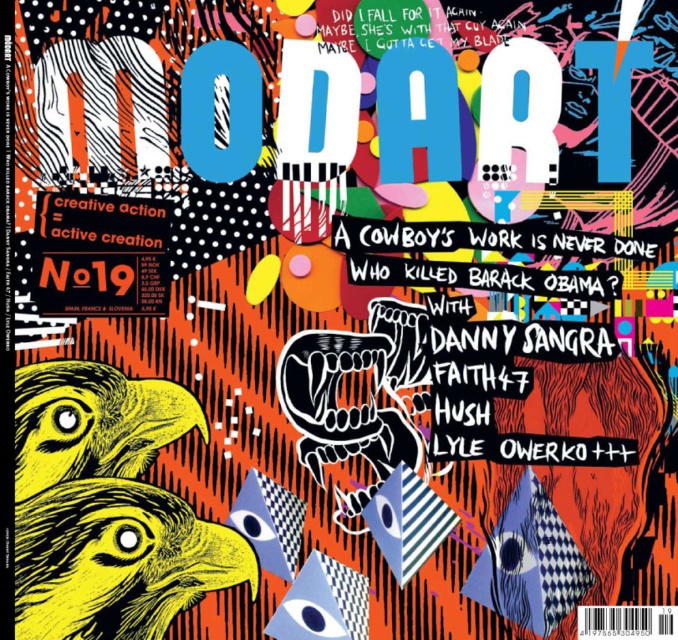
Can you confirm if yellow linework eagle at lower left is bigger than yellow linocut eagle at lower left?

Correct, yellow linework eagle at lower left is larger in size than yellow linocut eagle at lower left.

Can you confirm if yellow linework eagle at lower left is thinner than yellow linocut eagle at lower left?

Incorrect, yellow linework eagle at lower left's width is not less than yellow linocut eagle at lower left's.

Who is more forward, [54,609] or [161,417]?

Point [54,609]

This screenshot has width=678, height=640. In order to click on yellow linework eagle at lower left in this screenshot , I will do `click(117, 561)`.